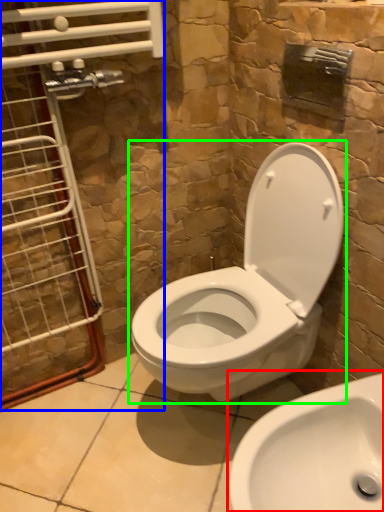
Question: Estimate the real-world distances between objects in this image. Which object is farther from sink (highlighted by a red box), glass door (highlighted by a blue box) or toilet (highlighted by a green box)?

Choices:
 (A) glass door
 (B) toilet

Answer: (A)